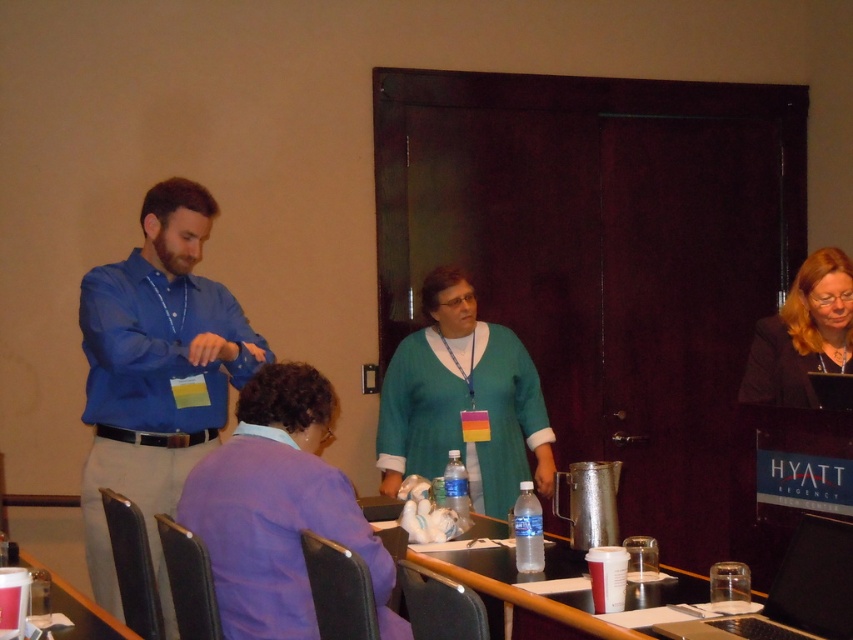
Consider the image. Does blue shirt at left appear on the right side of smooth plastic table at lower left?

Yes, blue shirt at left is to the right of smooth plastic table at lower left.

Is blue shirt at left positioned before smooth plastic table at lower left?

No.

Who is more forward, (x=128, y=458) or (x=91, y=636)?

A: Point (x=91, y=636)

I want to click on blue shirt at left, so click(x=155, y=372).

Between metallic silver laptop at center and black plastic laptop at lower right, which one has less height?

black plastic laptop at lower right is shorter.

Between point (550, 611) and point (784, 618), which one is positioned in front?

Positioned in front is point (784, 618).

Is point (825, 589) more distant than point (840, 541)?

No, it is in front of (840, 541).

Identify the location of metallic silver laptop at center. The width and height of the screenshot is (853, 640). (814, 582).

Between matte black jacket at upper right and smooth plastic table at lower left, which one appears on the left side from the viewer's perspective?

From the viewer's perspective, smooth plastic table at lower left appears more on the left side.

Can you confirm if matte black jacket at upper right is positioned below smooth plastic table at lower left?

Actually, matte black jacket at upper right is above smooth plastic table at lower left.

The width and height of the screenshot is (853, 640). What do you see at coordinates (804, 333) in the screenshot? I see `matte black jacket at upper right` at bounding box center [804, 333].

This screenshot has height=640, width=853. Find the location of `matte black jacket at upper right`. matte black jacket at upper right is located at coordinates (804, 333).